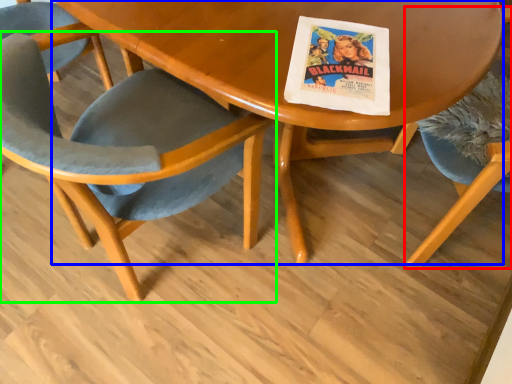
Question: Based on their relative distances, which object is nearer to chair (highlighted by a red box)? Choose from table (highlighted by a blue box) and chair (highlighted by a green box).

Choices:
 (A) table
 (B) chair

Answer: (A)